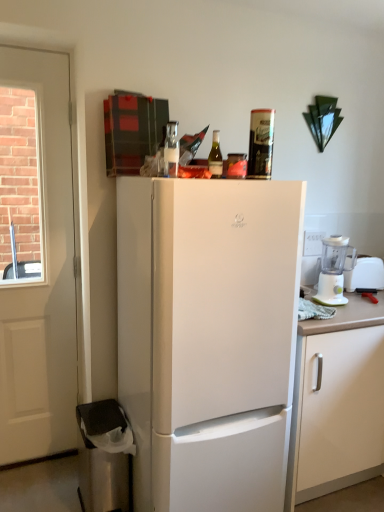
Identify the location of vacant space to the right of white plastic blender at right. (364, 303).